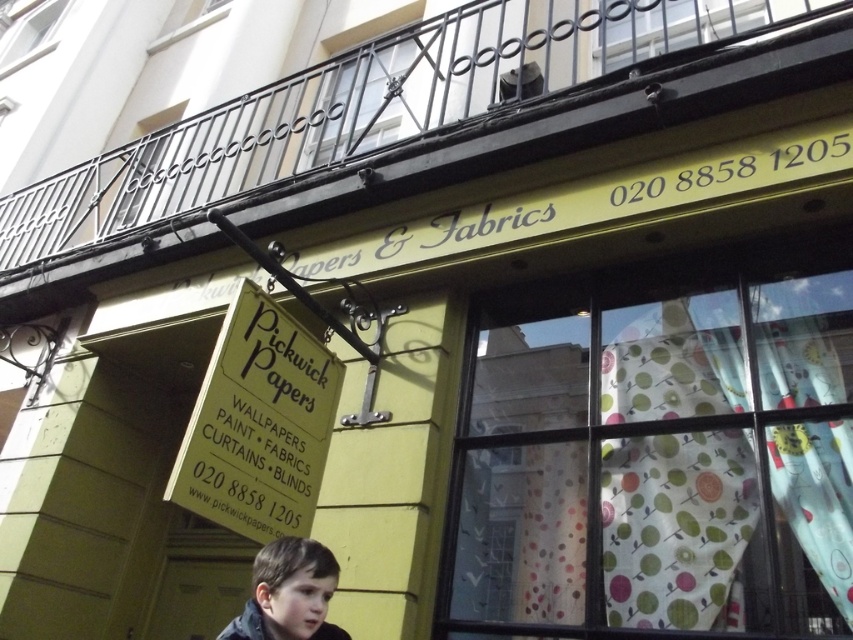
You are a customer standing in front of the shop and see the point at coordinates (659, 454). What is the color of the fabric at that point?

The point at coordinates (659, 454) is on polka dot fabric at center, but the description does not specify the color of the fabric. Therefore, the color cannot be determined from the given information.

You are standing in front of the shop and see the polka dot fabric at center and the dark brown hair at lower left. Which object is closer to you?

The polka dot fabric at center is closer to you because it is further to the viewer than the dark brown hair at lower left.

You are a customer entering the shop and see the polka dot fabric at center and the dark brown hair at lower left. Which object takes up more space in the image?

The polka dot fabric at center is bigger than the dark brown hair at lower left, so it takes up more space in the image.